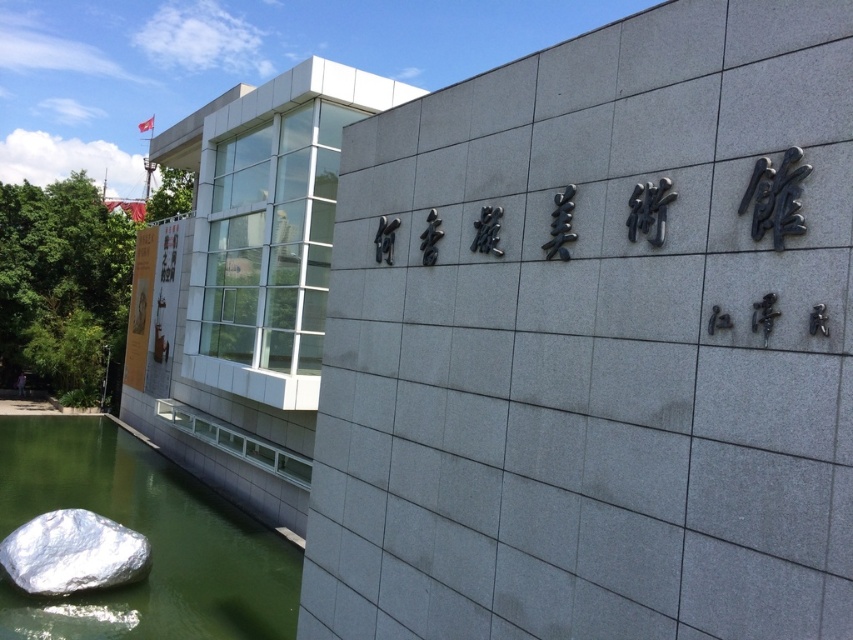
Does green reflective water at lower left have a larger size compared to shiny metallic rock at lower left?

Yes.

Is point (82, 500) closer to camera compared to point (141, 540)?

No, it is not.

You are a GUI agent. You are given a task and a screenshot of the screen. Output one action in this format:
    pyautogui.click(x=<x>, y=<y>)
    Task: Click on the green reflective water at lower left
    The width and height of the screenshot is (853, 640).
    Given the screenshot: What is the action you would take?
    pyautogui.click(x=148, y=538)